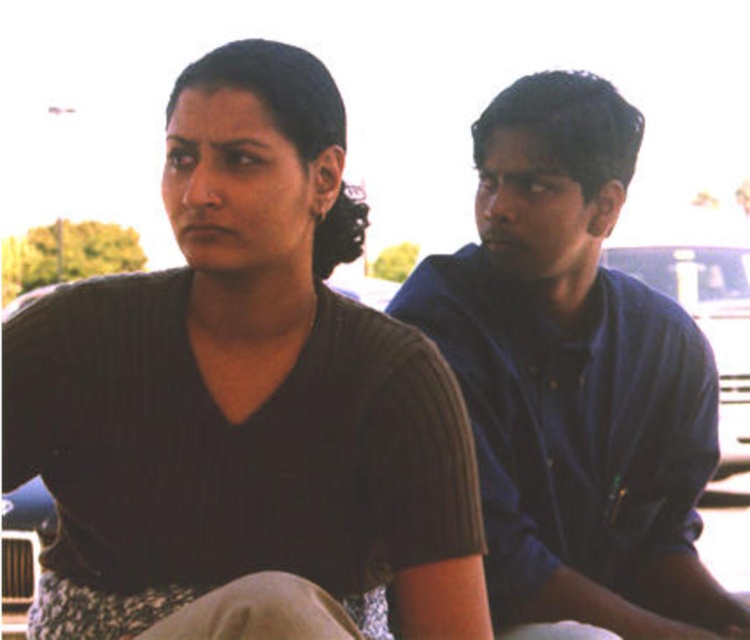
Question: Is matte brown shirt at center positioned at the back of blue cotton shirt at right?

Choices:
 (A) no
 (B) yes

Answer: (A)

Question: From the image, what is the correct spatial relationship of matte brown shirt at center in relation to blue cotton shirt at right?

Choices:
 (A) left
 (B) right

Answer: (A)

Question: Can you confirm if matte brown shirt at center is thinner than blue cotton shirt at right?

Choices:
 (A) yes
 (B) no

Answer: (B)

Question: Which object is closer to the camera taking this photo?

Choices:
 (A) matte brown shirt at center
 (B) blue cotton shirt at right

Answer: (A)